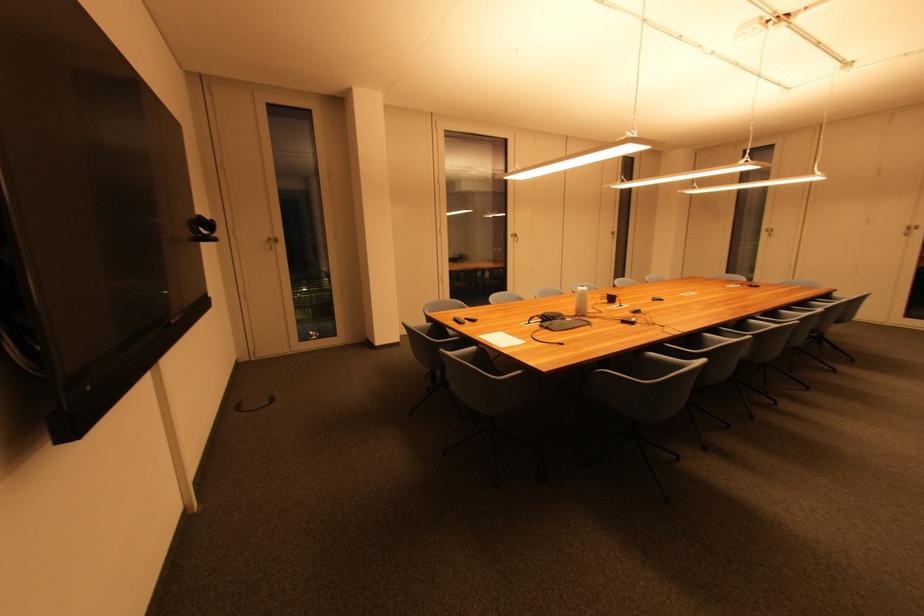
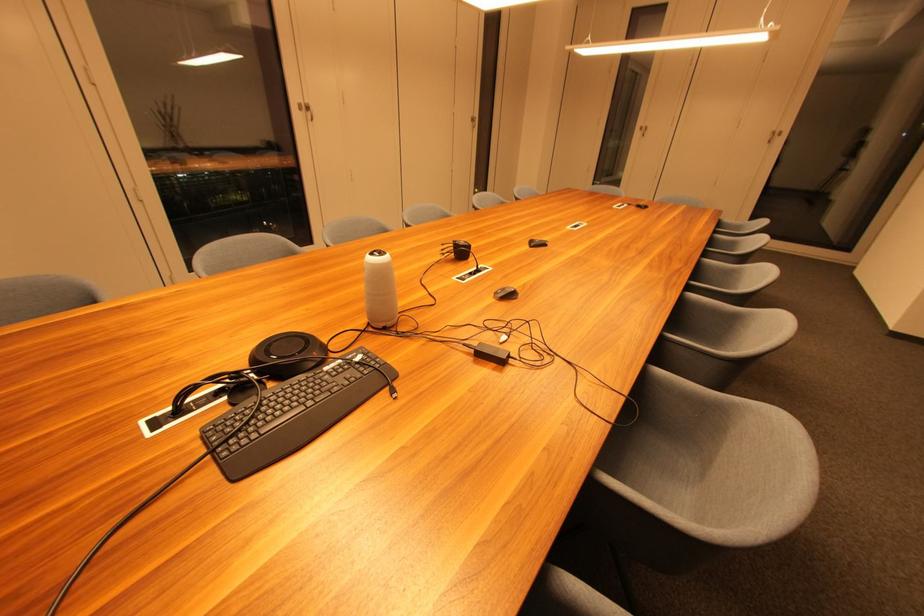
Where in the second image is the point corresponding to (x=587, y=315) from the first image?

(386, 326)